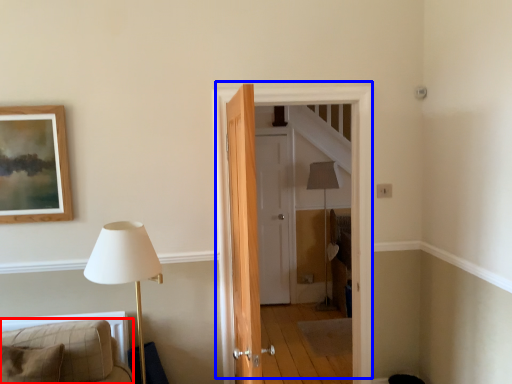
Question: Which object is further to the camera taking this photo, furniture (highlighted by a red box) or door (highlighted by a blue box)?

Choices:
 (A) furniture
 (B) door

Answer: (B)